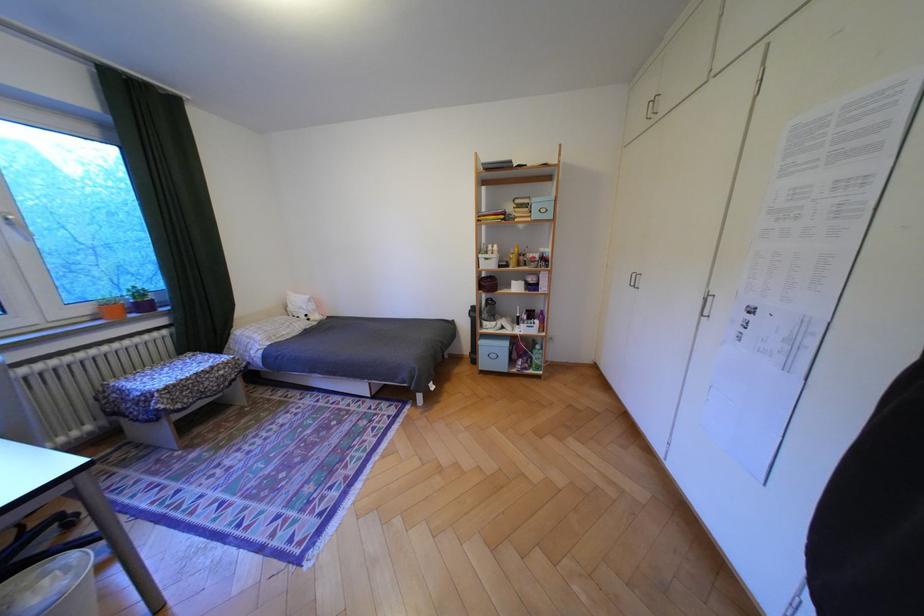
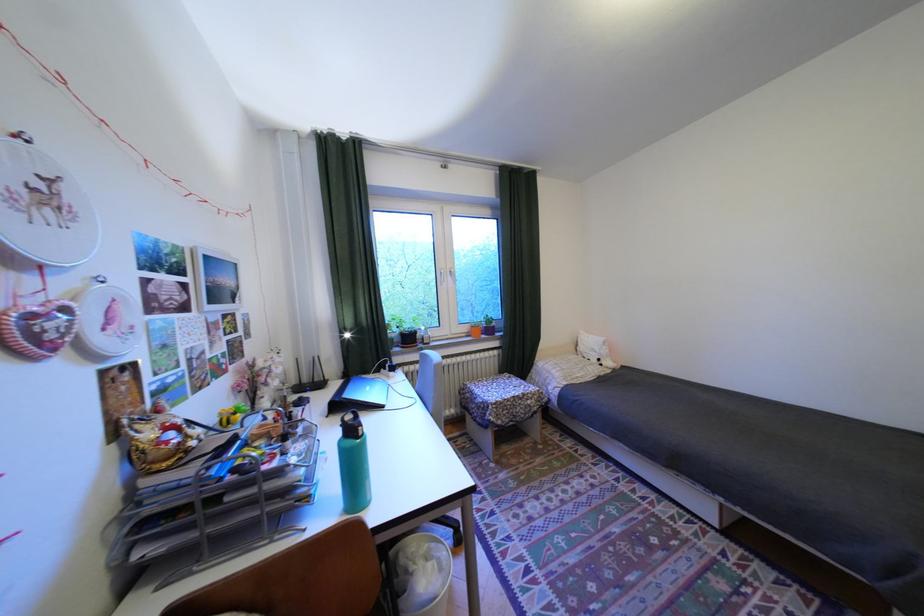
Question: The images are taken continuously from a first-person perspective. In which direction is your viewpoint rotating?

Choices:
 (A) Left
 (B) Right
 (C) Up
 (D) Down

Answer: (A)